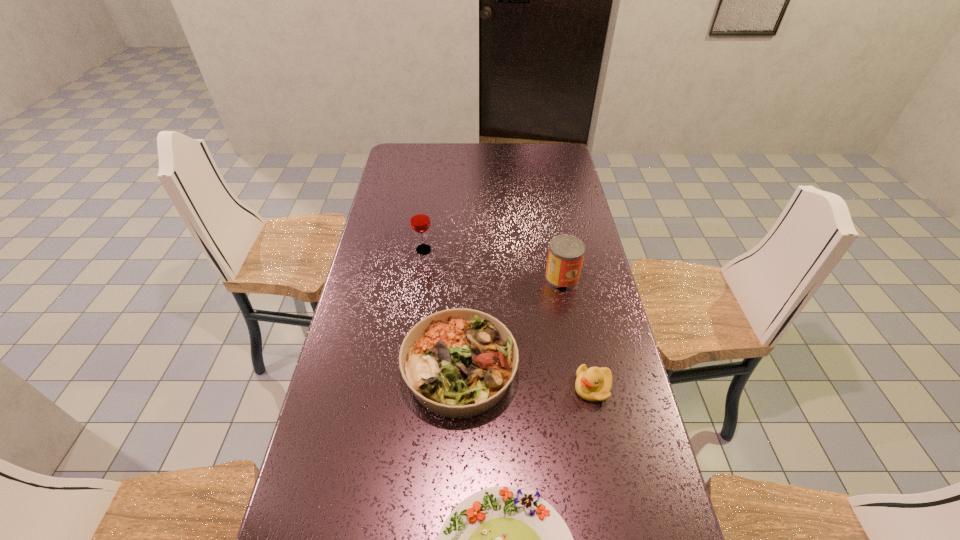
Locate an element on the screen. The width and height of the screenshot is (960, 540). the tallest object is located at coordinates (419, 217).

Locate an element on the screen. This screenshot has width=960, height=540. glass is located at coordinates (419, 217).

Find the location of a particular element. This screenshot has width=960, height=540. the fourth nearest object is located at coordinates (566, 252).

Identify the location of can. (566, 252).

Identify the location of the farther salad plate. The width and height of the screenshot is (960, 540). (458, 363).

Locate an element on the screen. This screenshot has width=960, height=540. duckling is located at coordinates (593, 384).

Where is `vacant space located on the back of the farthest object`? The width and height of the screenshot is (960, 540). vacant space located on the back of the farthest object is located at coordinates (428, 214).

The image size is (960, 540). Find the location of `free space located on the back of the can`. free space located on the back of the can is located at coordinates (558, 254).

The image size is (960, 540). Find the location of `vacant space located on the front of the farther salad plate`. vacant space located on the front of the farther salad plate is located at coordinates (456, 482).

This screenshot has height=540, width=960. Identify the location of vacant area situated 0.250m on the front-facing side of the duckling. (482, 388).